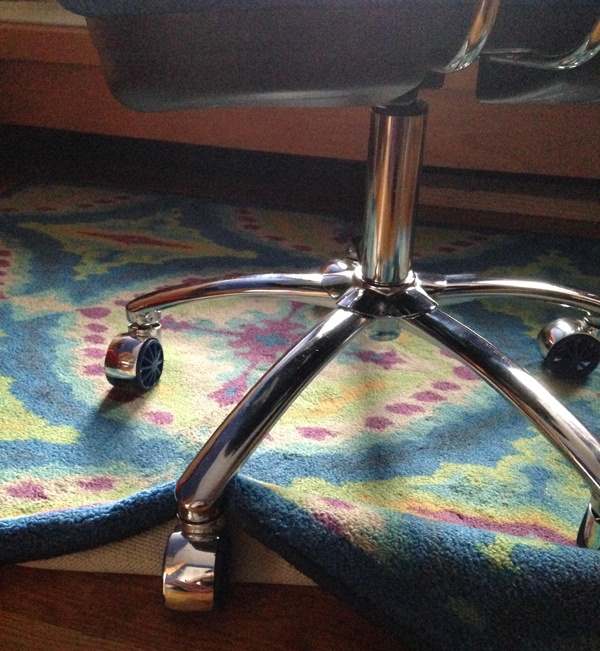
Locate an element on the screen. This screenshot has height=651, width=600. color change on furniture is located at coordinates (41, 15).